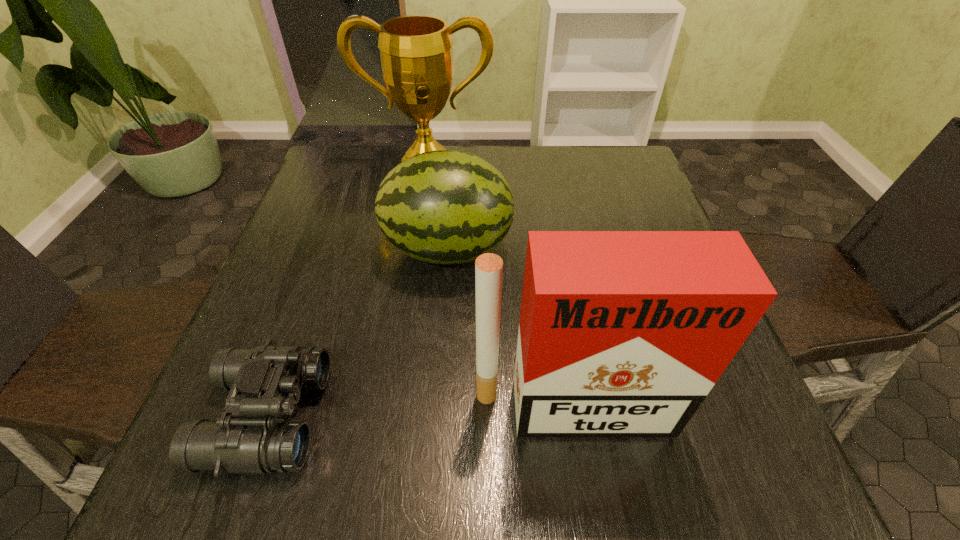
This screenshot has width=960, height=540. What are the coordinates of `unoccupied position between the second shortest object and the shortest object` in the screenshot? It's located at (357, 333).

In order to click on vacant point located between the third tallest object and the cigarette case in this screenshot , I will do `click(510, 328)`.

The image size is (960, 540). In order to click on free spot between the shortest object and the third nearest object in this screenshot , I will do `click(357, 333)`.

Locate an element on the screen. This screenshot has height=540, width=960. unoccupied position between the third tallest object and the shortest object is located at coordinates pyautogui.click(x=357, y=333).

This screenshot has width=960, height=540. Identify the location of vacant space that is in between the binoculars and the award. (347, 289).

The width and height of the screenshot is (960, 540). I want to click on free space between the third nearest object and the cigarette case, so click(510, 328).

This screenshot has width=960, height=540. Identify the location of free space between the cigarette case and the binoculars. (420, 412).

Choose which object is the third nearest neighbor to the cigarette case. Please provide its 2D coordinates. Your answer should be formatted as a tuple, i.e. [(x, y)], where the tuple contains the x and y coordinates of a point satisfying the conditions above.

[(416, 52)]

Identify which object is the second closest to the second farthest object. Please provide its 2D coordinates. Your answer should be formatted as a tuple, i.e. [(x, y)], where the tuple contains the x and y coordinates of a point satisfying the conditions above.

[(264, 382)]

You are a GUI agent. You are given a task and a screenshot of the screen. Output one action in this format:
    pyautogui.click(x=<x>, y=<y>)
    Task: Click on the free spot that satisfies the following two spatial constraints: 1. on the front-facing side of the cigarette case; 2. through the lenses of the binoculars
    
    Given the screenshot: What is the action you would take?
    pyautogui.click(x=573, y=416)